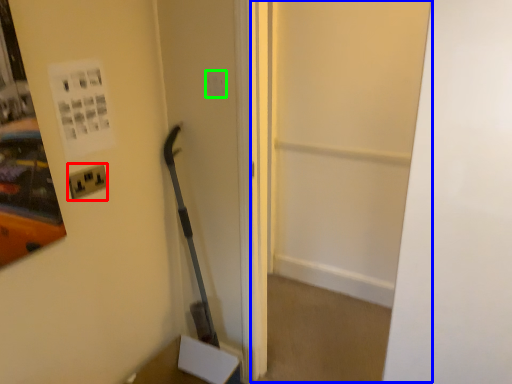
Question: Which object is positioned farthest from electric outlet (highlighted by a red box)? Select from glass door (highlighted by a blue box) and light switch (highlighted by a green box).

Choices:
 (A) glass door
 (B) light switch

Answer: (A)